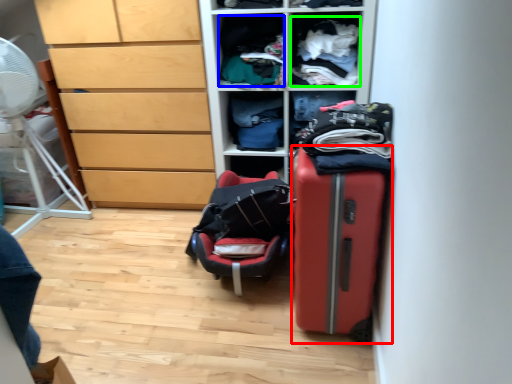
Question: Which object is positioned farthest from suitcase (highlighted by a red box)? Select from clothing (highlighted by a blue box) and clothing (highlighted by a green box).

Choices:
 (A) clothing
 (B) clothing

Answer: (A)